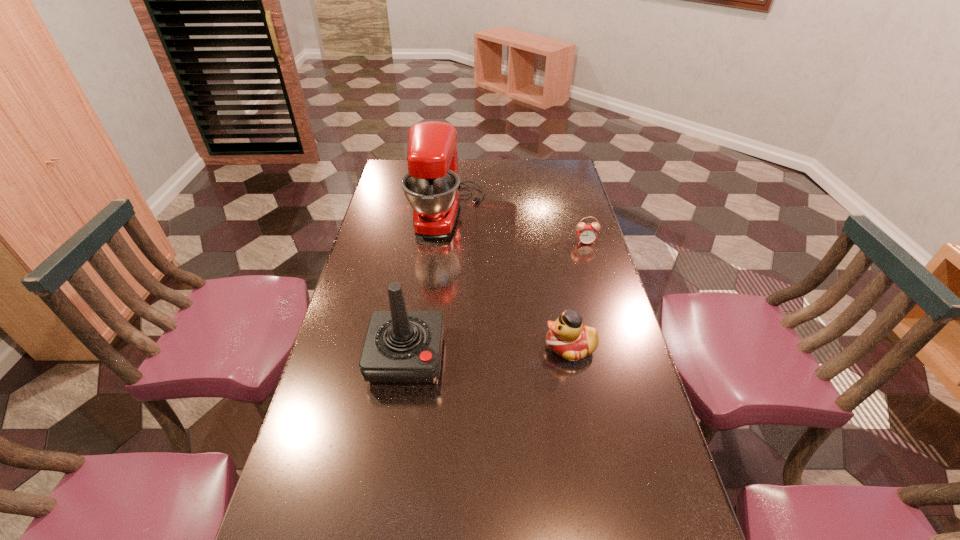
This screenshot has height=540, width=960. Find the location of `vacant area situated 0.290m on the face of the third object from left to right`. vacant area situated 0.290m on the face of the third object from left to right is located at coordinates (441, 347).

Where is `vacant space located 0.120m on the clock face of the rightmost object`? The image size is (960, 540). vacant space located 0.120m on the clock face of the rightmost object is located at coordinates (593, 267).

Find the location of a particular element. object located at the far edge is located at coordinates (431, 186).

What are the coordinates of `kitchen mixer at the left edge` in the screenshot? It's located at (431, 186).

The image size is (960, 540). I want to click on joystick present at the left edge, so click(x=401, y=347).

I want to click on duck that is at the right edge, so click(x=568, y=337).

Locate an element on the screen. This screenshot has height=540, width=960. alarm clock that is positioned at the right edge is located at coordinates click(x=587, y=234).

Where is `object that is at the far left corner`? The height and width of the screenshot is (540, 960). object that is at the far left corner is located at coordinates (431, 186).

The width and height of the screenshot is (960, 540). In the image, there is a desktop. Identify the location of free space at the far edge. (481, 178).

At what (x,y) coordinates should I click in order to perform the action: click on free space at the left edge of the desktop. Please return your answer as a coordinate pair (x, y). The width and height of the screenshot is (960, 540). Looking at the image, I should click on (357, 445).